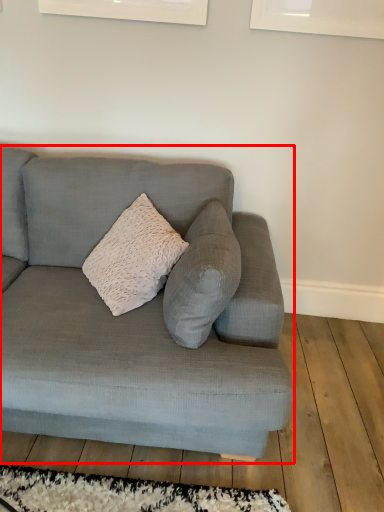
Question: Considering the relative positions of studio couch (annotated by the red box) and mat in the image provided, where is studio couch (annotated by the red box) located with respect to the staircase?

Choices:
 (A) left
 (B) right

Answer: (A)